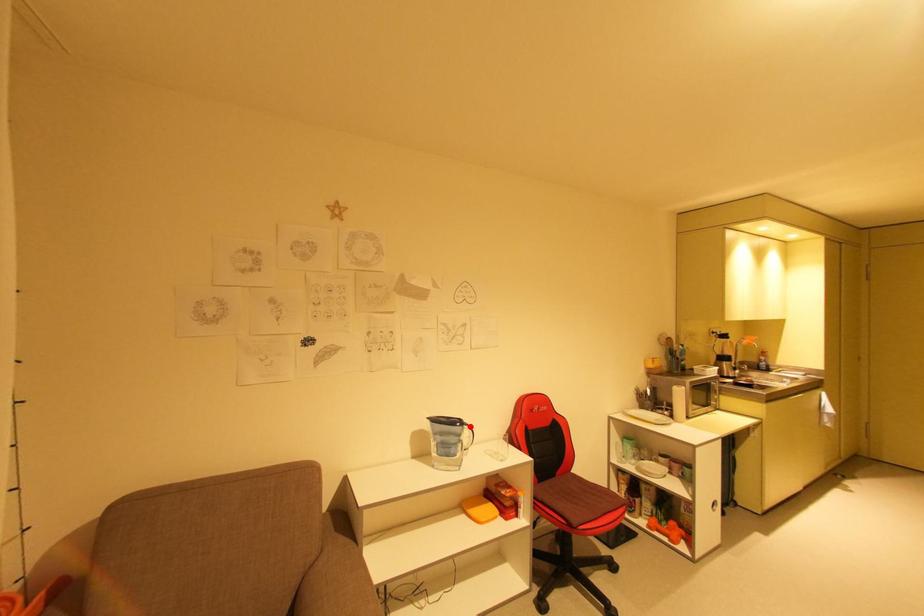
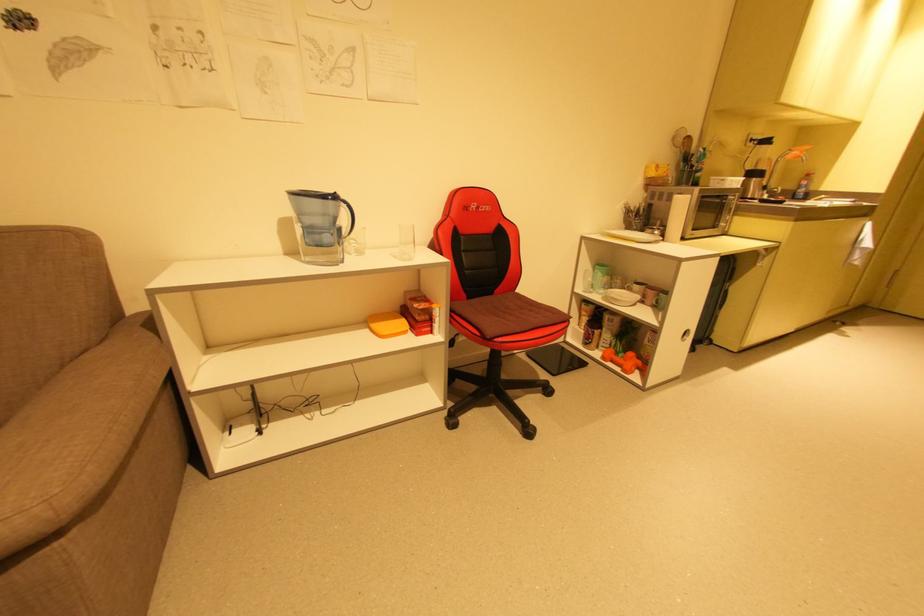
In the second image, find the point that corresponds to the highlighted location in the first image.

(346, 204)